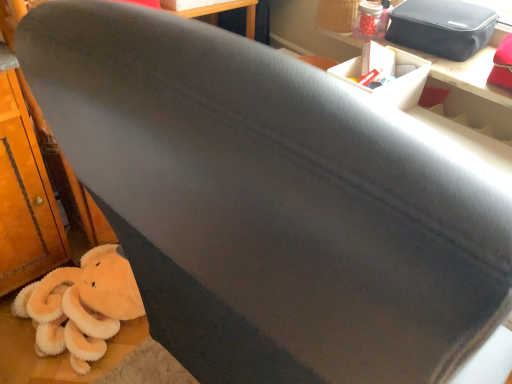
Question: Does matte black table at upper right turn towards fluffy orange stuffed animal at lower left?

Choices:
 (A) no
 (B) yes

Answer: (A)

Question: Is matte black table at upper right positioned before fluffy orange stuffed animal at lower left?

Choices:
 (A) yes
 (B) no

Answer: (A)

Question: Can you confirm if matte black table at upper right is shorter than fluffy orange stuffed animal at lower left?

Choices:
 (A) yes
 (B) no

Answer: (A)

Question: Is matte black table at upper right bigger than fluffy orange stuffed animal at lower left?

Choices:
 (A) no
 (B) yes

Answer: (A)

Question: Would you say matte black table at upper right is outside fluffy orange stuffed animal at lower left?

Choices:
 (A) yes
 (B) no

Answer: (A)

Question: Looking at their shapes, would you say black fabric bag at upper right is wider or thinner than fluffy orange stuffed animal at lower left?

Choices:
 (A) wide
 (B) thin

Answer: (B)

Question: From a real-world perspective, is black fabric bag at upper right positioned above or below fluffy orange stuffed animal at lower left?

Choices:
 (A) below
 (B) above

Answer: (B)

Question: Considering the positions of point (479, 11) and point (60, 299), is point (479, 11) closer or farther from the camera than point (60, 299)?

Choices:
 (A) farther
 (B) closer

Answer: (B)

Question: From the image's perspective, is black fabric bag at upper right located above or below fluffy orange stuffed animal at lower left?

Choices:
 (A) above
 (B) below

Answer: (A)

Question: Considering the positions of point (458, 36) and point (395, 107), is point (458, 36) closer or farther from the camera than point (395, 107)?

Choices:
 (A) farther
 (B) closer

Answer: (A)

Question: Considering the relative positions of black fabric bag at upper right and white cardboard box at upper right in the image provided, is black fabric bag at upper right to the left or to the right of white cardboard box at upper right?

Choices:
 (A) left
 (B) right

Answer: (B)

Question: Would you say black fabric bag at upper right is inside or outside white cardboard box at upper right?

Choices:
 (A) inside
 (B) outside

Answer: (B)

Question: In terms of height, does black fabric bag at upper right look taller or shorter compared to white cardboard box at upper right?

Choices:
 (A) tall
 (B) short

Answer: (B)

Question: Does point (426, 74) appear closer or farther from the camera than point (466, 62)?

Choices:
 (A) farther
 (B) closer

Answer: (B)

Question: Relative to matte black table at upper right, is white cardboard box at upper right in front or behind?

Choices:
 (A) front
 (B) behind

Answer: (B)